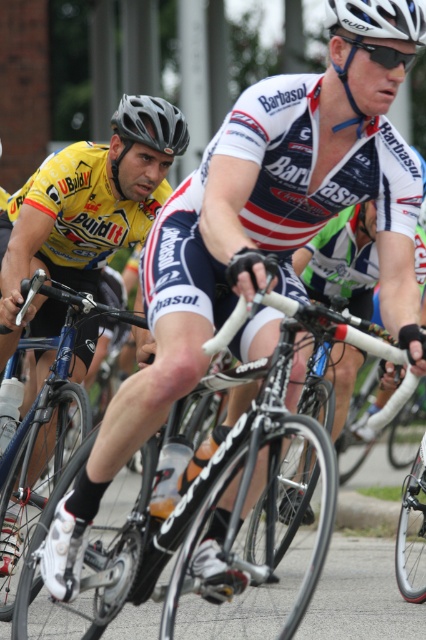
Question: Among these points, which one is nearest to the camera?

Choices:
 (A) (175, 131)
 (B) (290, 304)
 (C) (382, 26)

Answer: (B)

Question: Can you confirm if white matte helmet at upper center is positioned to the left of white matte bicycle helmet at upper center?

Choices:
 (A) no
 (B) yes

Answer: (B)

Question: Estimate the real-world distances between objects in this image. Which object is farther from the white matte helmet at upper center?

Choices:
 (A) shiny blue frame at center
 (B) white matte bicycle helmet at upper center

Answer: (A)

Question: Which object is farther from the camera taking this photo?

Choices:
 (A) white matte helmet at upper center
 (B) matte black helmet at upper center

Answer: (B)

Question: Is shiny black frame at center positioned at the back of matte black helmet at upper center?

Choices:
 (A) yes
 (B) no

Answer: (B)

Question: Is shiny black frame at center thinner than shiny blue frame at center?

Choices:
 (A) yes
 (B) no

Answer: (A)